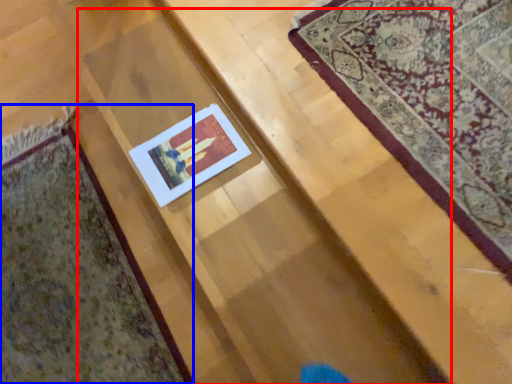
Question: Which of the following is the farthest to the observer, stairwell (highlighted by a red box) or mat (highlighted by a blue box)?

Choices:
 (A) stairwell
 (B) mat

Answer: (B)